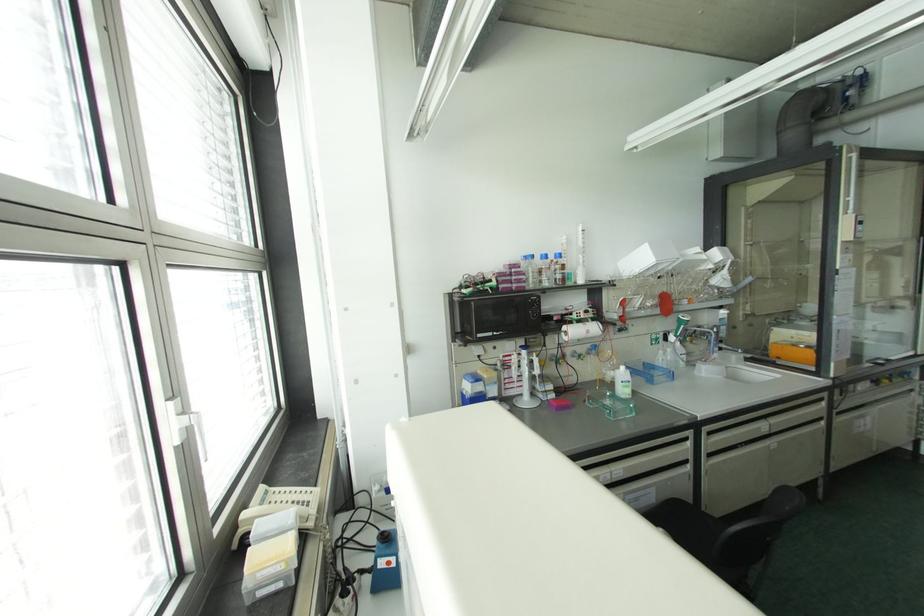
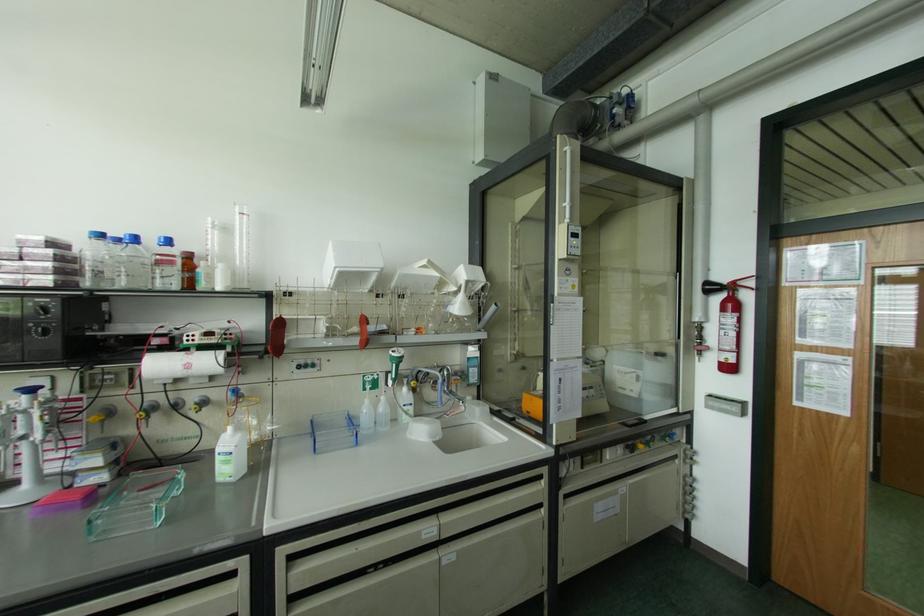
Where in the second image is the point corresponding to pixel 558 254 from the first image?

(167, 241)